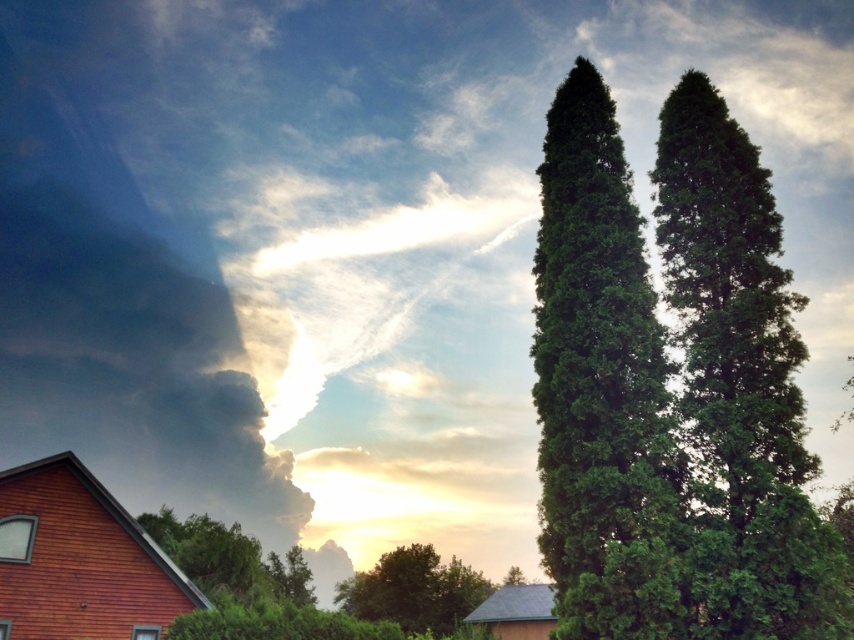
You are a painter setting up your easel to capture the scene. You want to focus on the green textured cypress at right and the green leafy tree at lower left. Which tree should you move closer to if you want both trees to appear equally large in your painting?

You should move closer to the green textured cypress at right because it occupies less space, so increasing its apparent size will help balance both trees in the painting.

You are an architect designing a garden path that must pass between the green textured cypress at right and the green leafy tree at center. Given that the path needs to be at least 2 meters wide, can the existing space accommodate this requirement?

The green textured cypress at right has a lesser width compared to green leafy tree at center. Since the path needs to be at least 2 meters wide, the space between them can accommodate the path as the cypress is narrower than the leafy tree, providing sufficient space.